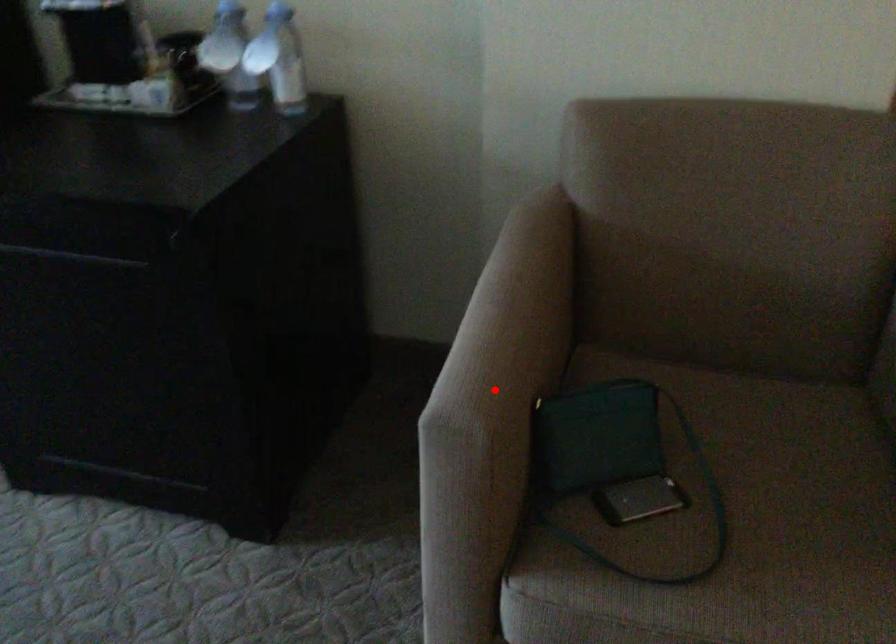
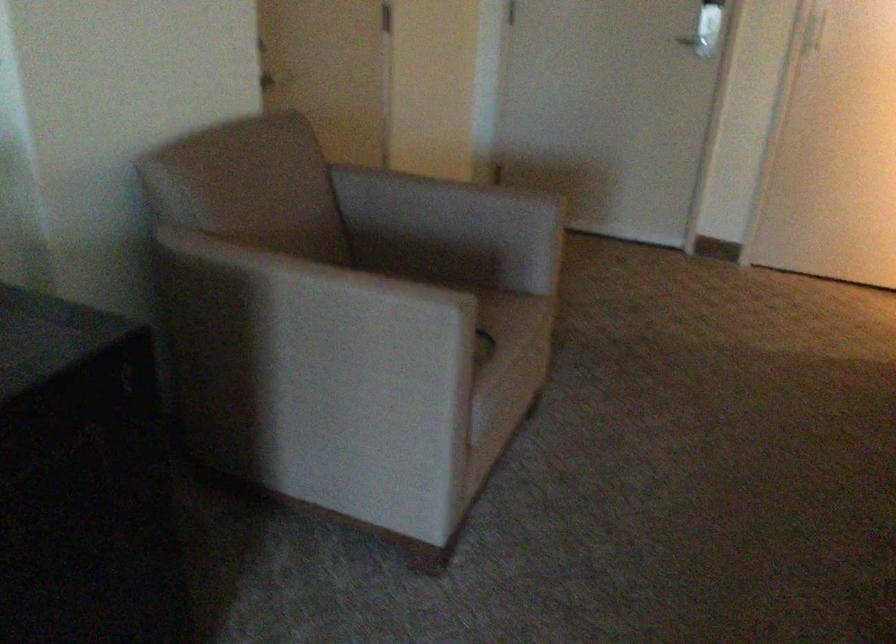
Question: I am providing you with two images of the same scene from different viewpoints. Given a red point in image1, look at the same physical point in image2. Is it:

Choices:
 (A) Closer to the viewpoint
 (B) Farther from the viewpoint

Answer: (B)